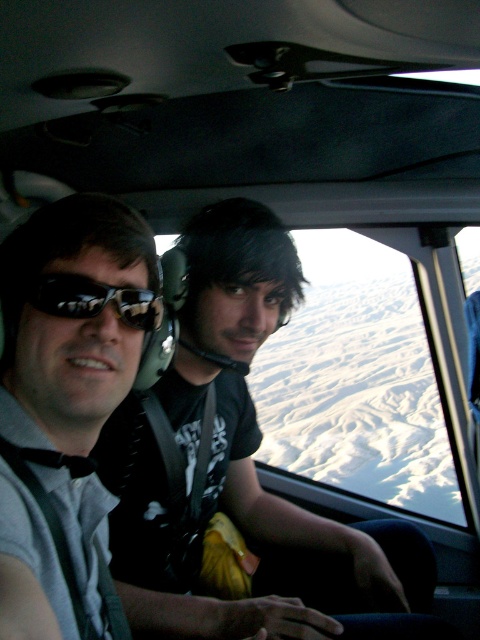
Question: Among these points, which one is nearest to the camera?

Choices:
 (A) (263, 618)
 (B) (63, 300)

Answer: (B)

Question: Is matte black helmet at center to the left of matte black sunglasses at left from the viewer's perspective?

Choices:
 (A) yes
 (B) no

Answer: (B)

Question: Which of the following is the closest to the observer?

Choices:
 (A) matte black helmet at center
 (B) matte black sunglasses at left

Answer: (B)

Question: Where is matte black helmet at center located in relation to matte black sunglasses at left in the image?

Choices:
 (A) below
 (B) above

Answer: (A)

Question: Does matte black helmet at center have a lesser width compared to matte black sunglasses at left?

Choices:
 (A) yes
 (B) no

Answer: (B)